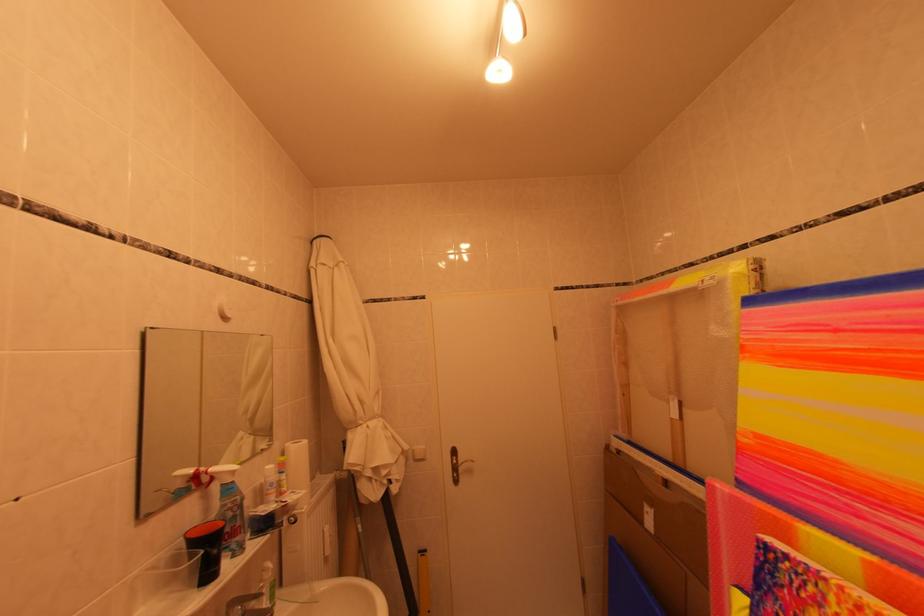
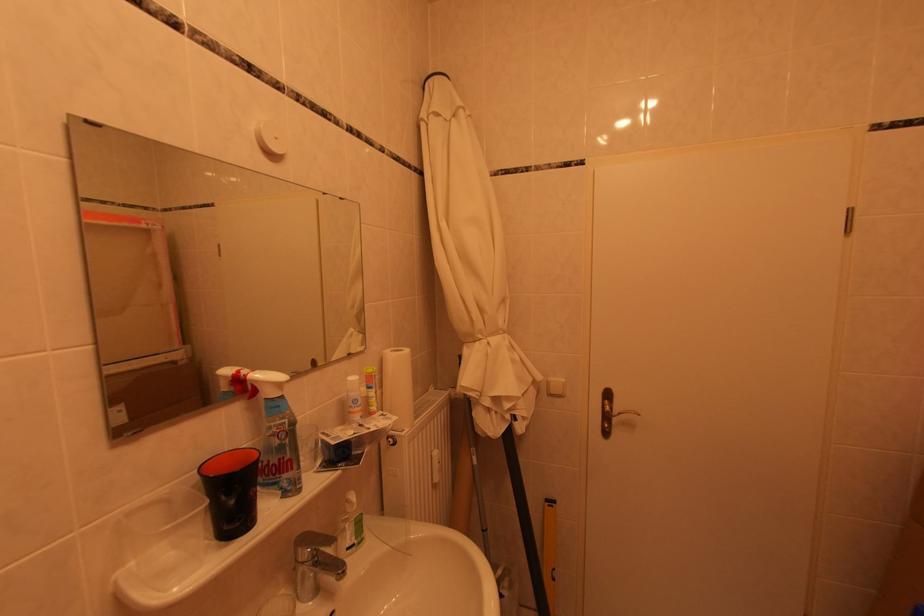
Question: The images are taken continuously from a first-person perspective. In which direction are you moving?

Choices:
 (A) Left
 (B) Right
 (C) Forward
 (D) Backward

Answer: (C)